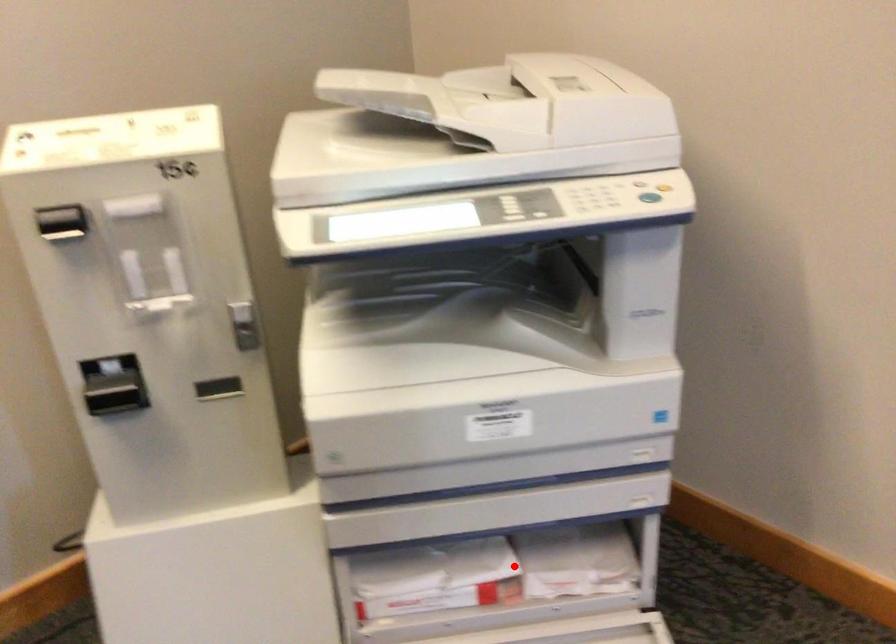
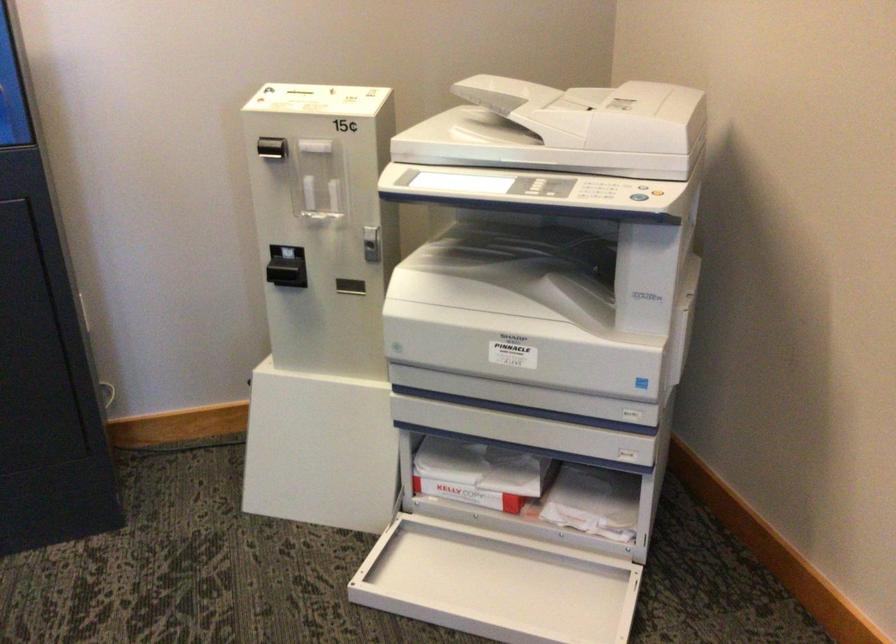
Question: I am providing you with two images of the same scene from different viewpoints. A red point is shown in image1. For the corresponding object point in image2, is it positioned nearer or farther from the camera?

Choices:
 (A) Nearer
 (B) Farther

Answer: (B)